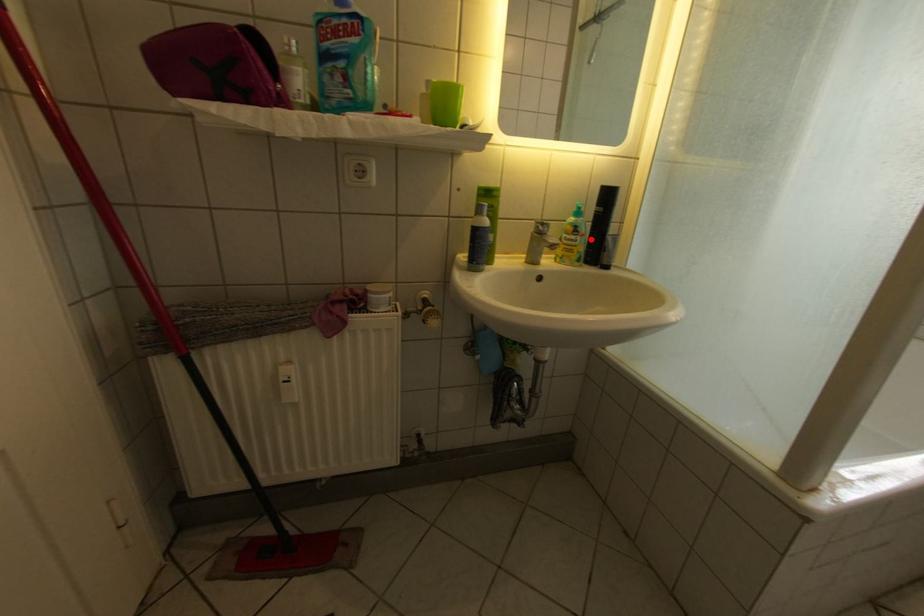
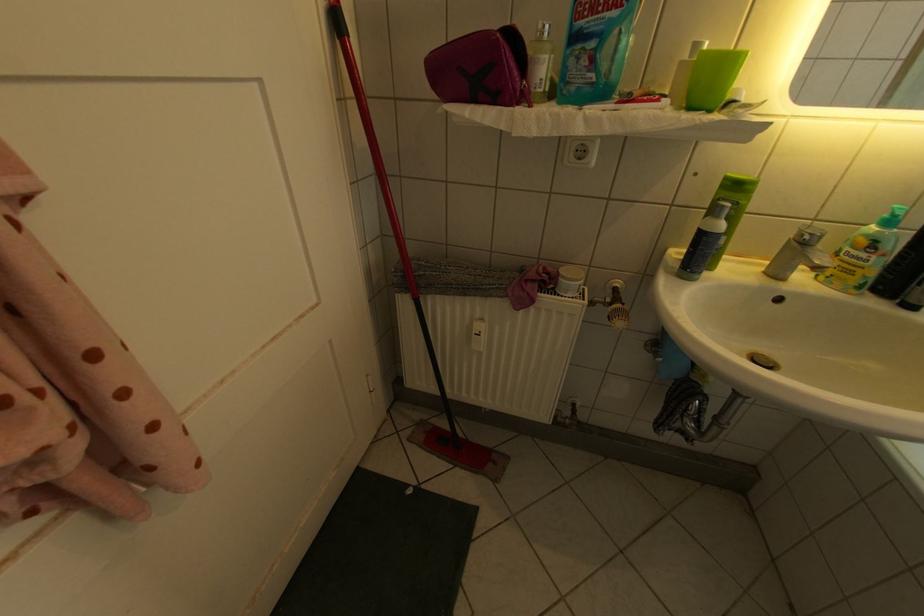
Question: I am providing you with two images of the same scene from different viewpoints. In image1, a red point is highlighted. Considering the same 3D point in image2, which of the following is correct?

Choices:
 (A) It is closer
 (B) It is farther

Answer: (B)